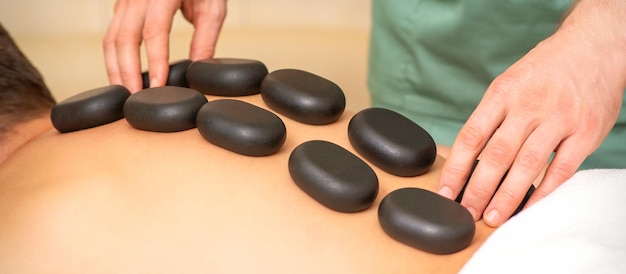
Identify the location of white towel. The width and height of the screenshot is (626, 274). pos(573,225).